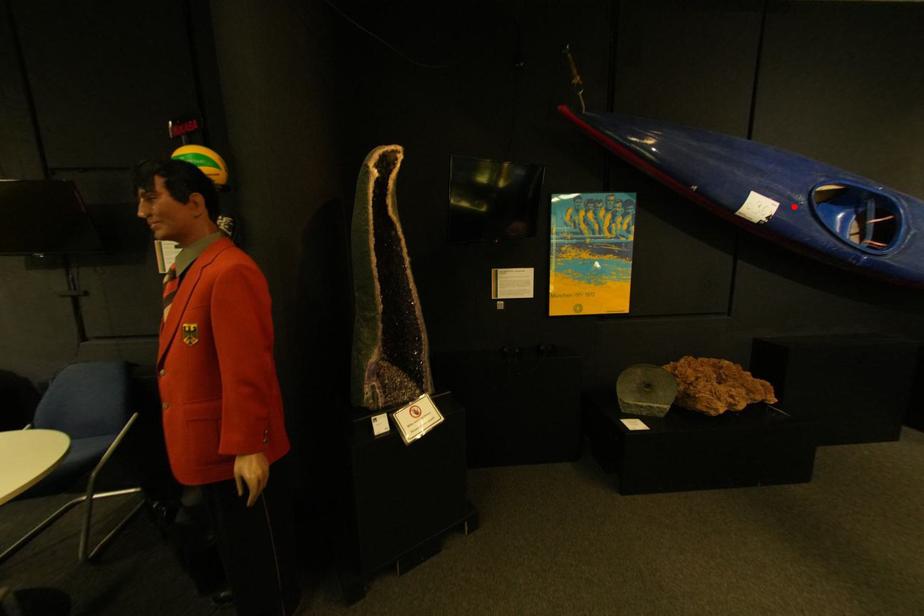
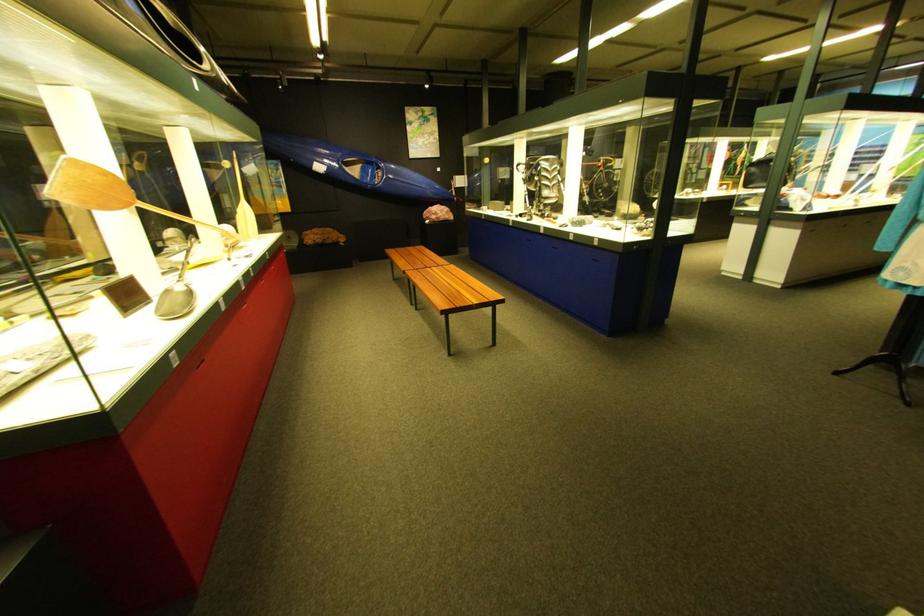
Question: I am providing you with two images of the same scene from different viewpoints. Image1 has a red point marked. In image2, the corresponding 3D location appears at what relative position? Reply with the corresponding letter.

Choices:
 (A) Closer
 (B) Farther

Answer: (A)